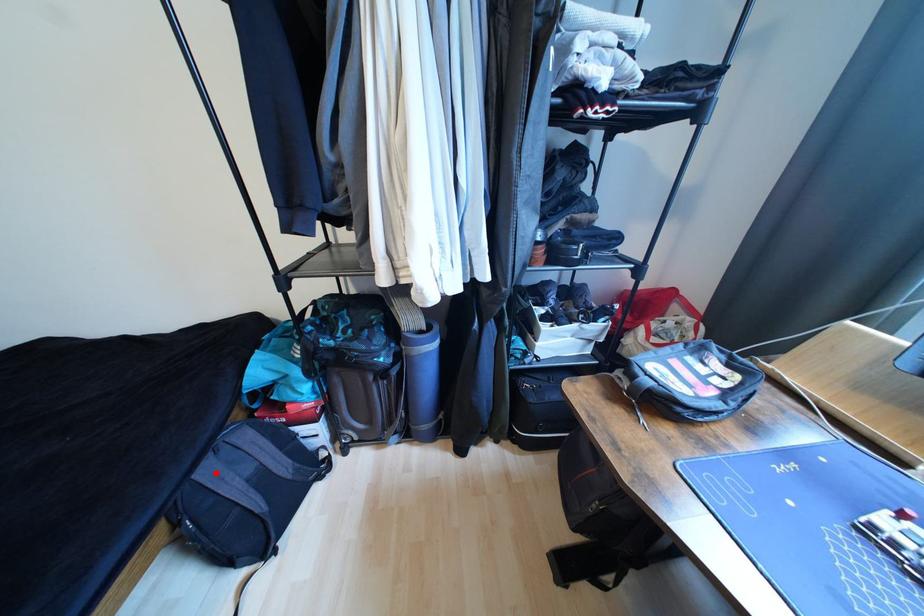
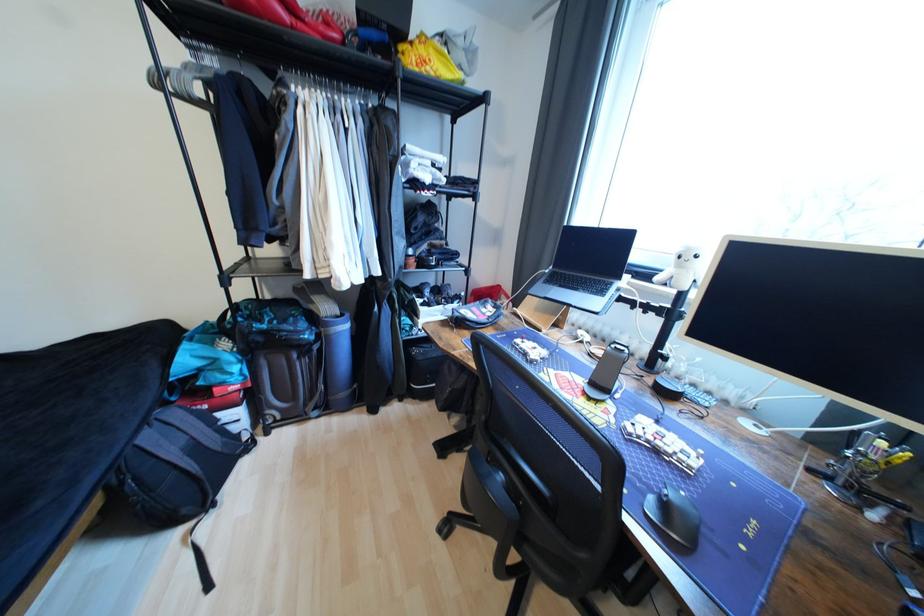
Locate, in the second image, the point that corresponds to the highlighted location in the first image.

(155, 439)